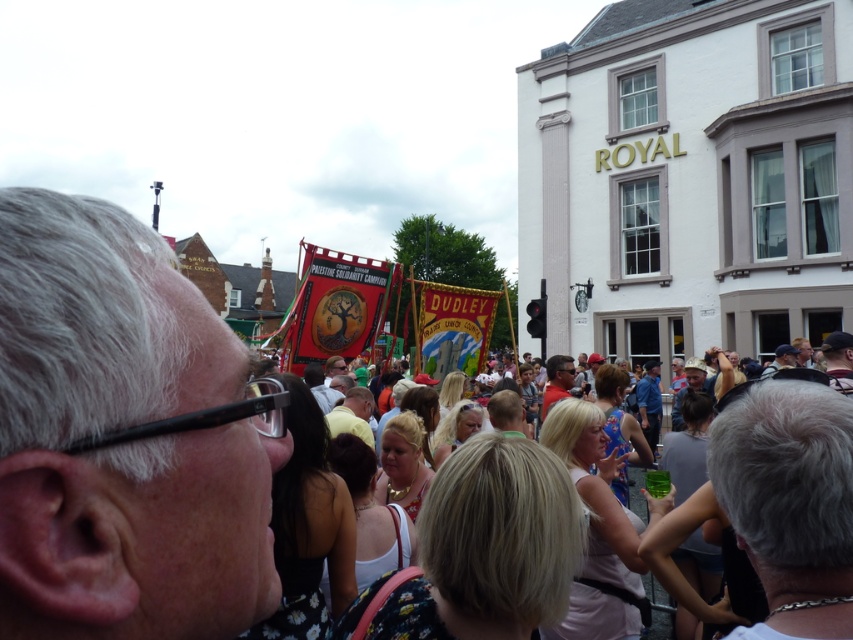
What is the exact location of the gray hair at upper left in the image?

The gray hair at upper left is located at point [120,442].

You are a photographer trying to capture a photo of the gray hair at upper left and the dark blue shirt at center. Based on their heights, which one should you focus on to ensure they are both visible in the frame?

Since the gray hair at upper left is taller than the dark blue shirt at center, you should focus on the gray hair at upper left to ensure both are visible in the frame.

You are a photographer at the event and want to capture a photo that includes both the gray hair at upper left and dark blue shirt at center. Which object should you focus on first to ensure both are in frame?

The gray hair at upper left is above dark blue shirt at center, so you should focus on the dark blue shirt at center first to ensure both are in frame.